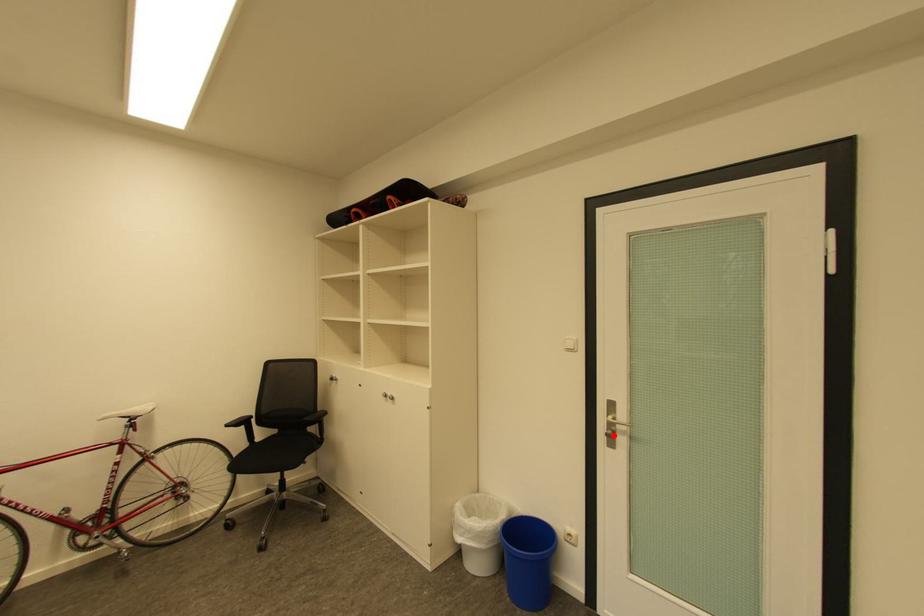
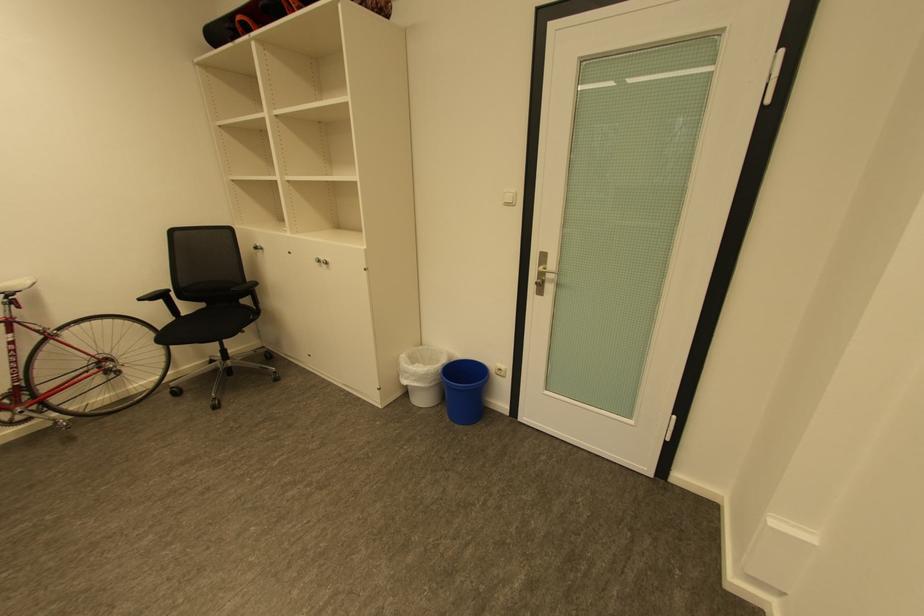
Where in the second image is the point corresponding to the highlighted location from the first image?

(543, 284)